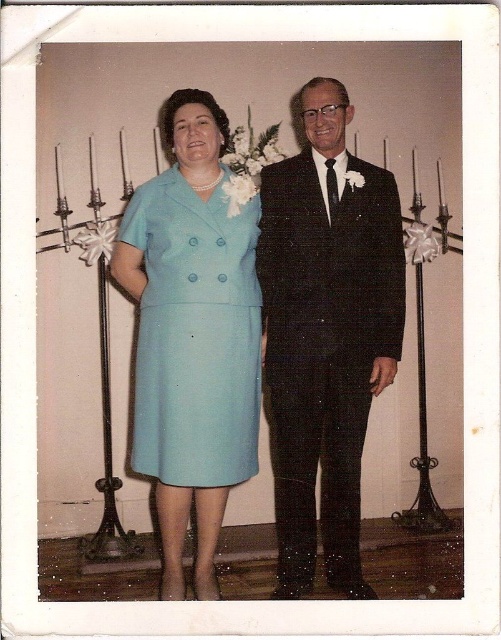
Question: Can you confirm if black textured suit at center is positioned to the left of light blue fabric dress at center?

Choices:
 (A) no
 (B) yes

Answer: (A)

Question: Which of the following is the farthest from the observer?

Choices:
 (A) black textured suit at center
 (B) light blue fabric dress at center

Answer: (A)

Question: Does black textured suit at center have a lesser width compared to light blue fabric dress at center?

Choices:
 (A) yes
 (B) no

Answer: (B)

Question: Is black textured suit at center to the right of light blue fabric dress at center from the viewer's perspective?

Choices:
 (A) no
 (B) yes

Answer: (B)

Question: Which of the following is the closest to the observer?

Choices:
 (A) light blue fabric dress at center
 (B) black textured suit at center

Answer: (A)